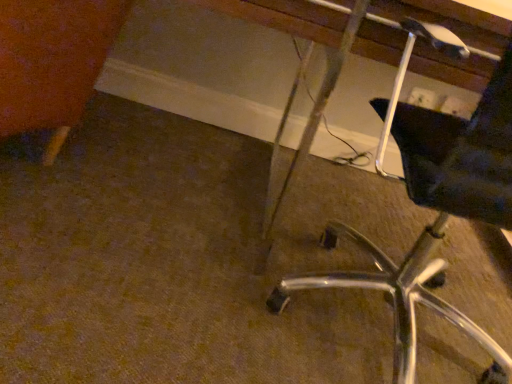
Question: Is metallic silver vanity at lower right not within black fabric chair at right?

Choices:
 (A) yes
 (B) no

Answer: (A)

Question: Is black fabric chair at right located within metallic silver vanity at lower right?

Choices:
 (A) no
 (B) yes

Answer: (B)

Question: Considering the relative sizes of metallic silver vanity at lower right and black fabric chair at right in the image provided, is metallic silver vanity at lower right smaller than black fabric chair at right?

Choices:
 (A) yes
 (B) no

Answer: (B)

Question: Can you confirm if metallic silver vanity at lower right is shorter than black fabric chair at right?

Choices:
 (A) no
 (B) yes

Answer: (A)

Question: From a real-world perspective, is metallic silver vanity at lower right below black fabric chair at right?

Choices:
 (A) no
 (B) yes

Answer: (B)

Question: Is metallic silver vanity at lower right oriented away from black fabric chair at right?

Choices:
 (A) no
 (B) yes

Answer: (B)

Question: From a real-world perspective, is black fabric chair at right below metallic silver vanity at lower right?

Choices:
 (A) no
 (B) yes

Answer: (A)

Question: Can you confirm if black fabric chair at right is shorter than metallic silver vanity at lower right?

Choices:
 (A) no
 (B) yes

Answer: (B)

Question: Is black fabric chair at right beside metallic silver vanity at lower right?

Choices:
 (A) no
 (B) yes

Answer: (A)

Question: Is black fabric chair at right to the left of metallic silver vanity at lower right from the viewer's perspective?

Choices:
 (A) yes
 (B) no

Answer: (B)

Question: Is black fabric chair at right thinner than metallic silver vanity at lower right?

Choices:
 (A) no
 (B) yes

Answer: (B)

Question: Is black fabric chair at right positioned before metallic silver vanity at lower right?

Choices:
 (A) yes
 (B) no

Answer: (A)

Question: Relative to black fabric chair at right, is metallic silver vanity at lower right in front or behind?

Choices:
 (A) behind
 (B) front

Answer: (A)